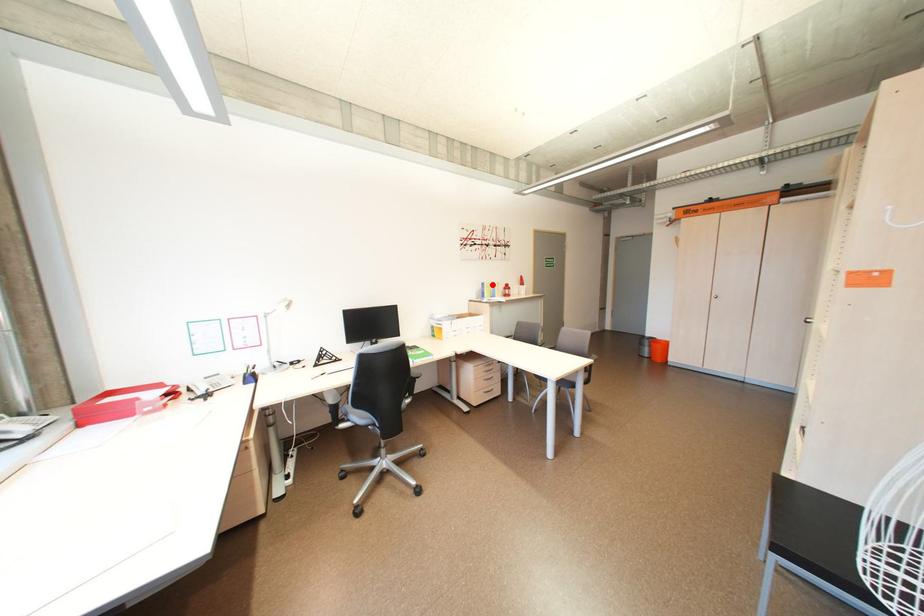
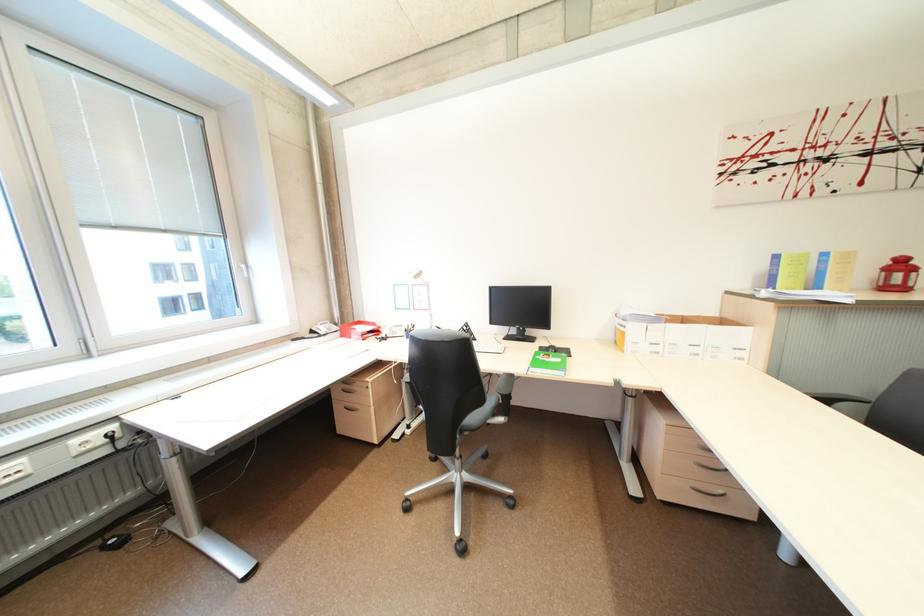
Question: A red point is marked in image1. In image2, is the corresponding 3D point closer to the camera or farther? Reply with the corresponding letter.

Choices:
 (A) The corresponding 3D point is closer.
 (B) The corresponding 3D point is farther.

Answer: (B)